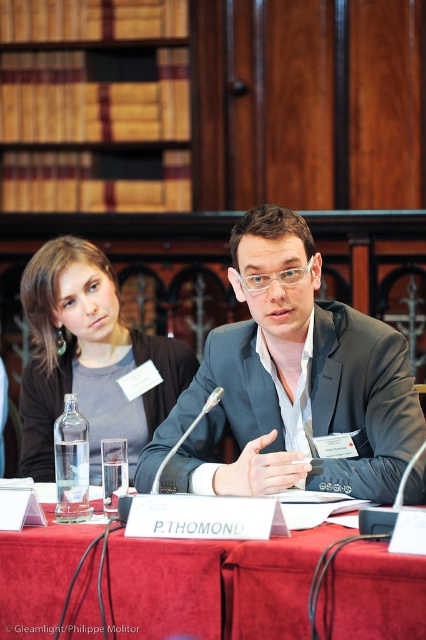
Question: Which point is closer to the camera?

Choices:
 (A) (149, 464)
 (B) (39, 317)

Answer: (A)

Question: Does red velvet table at center appear on the right side of brown leather book at upper left?

Choices:
 (A) yes
 (B) no

Answer: (A)

Question: Which of the following is the closest to the observer?

Choices:
 (A) matte black hair at upper left
 (B) red velvet table at center

Answer: (B)

Question: Is brown leather book at upper left positioned behind matte black hair at upper left?

Choices:
 (A) no
 (B) yes

Answer: (B)

Question: Does matte black suit at center appear under matte black hair at upper left?

Choices:
 (A) no
 (B) yes

Answer: (A)

Question: Which of the following is the closest to the observer?

Choices:
 (A) (6, 634)
 (B) (0, 4)
 (C) (226, 464)

Answer: (A)